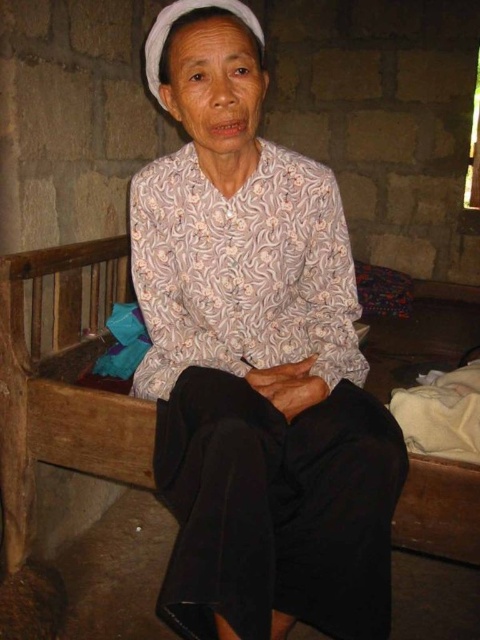
Is white printed blouse at center wider than wooden bench at center?

Yes, white printed blouse at center is wider than wooden bench at center.

Which of these two, white printed blouse at center or wooden bench at center, stands shorter?

wooden bench at center

Locate an element on the screen. white printed blouse at center is located at coordinates (254, 358).